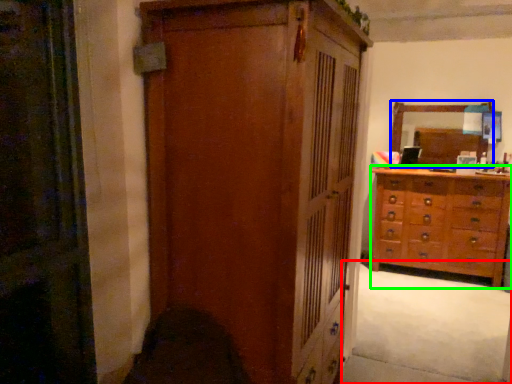
Question: Estimate the real-world distances between objects in this image. Which object is farther from plain (highlighted by a red box), mirror (highlighted by a blue box) or chest of drawers (highlighted by a green box)?

Choices:
 (A) mirror
 (B) chest of drawers

Answer: (A)